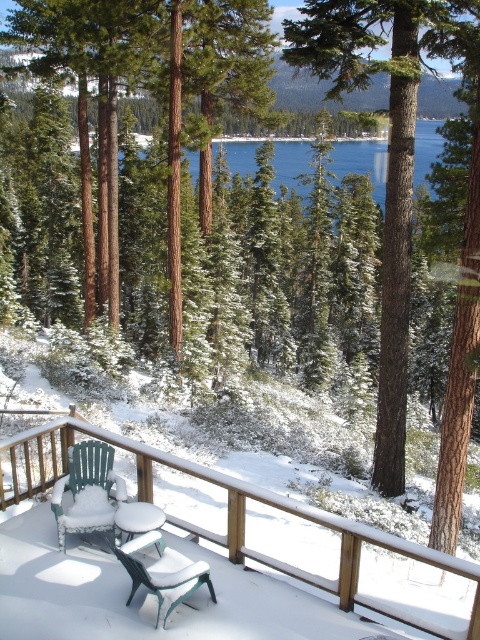
Question: Is blue water at center bigger than green plastic chair at lower center?

Choices:
 (A) no
 (B) yes

Answer: (B)

Question: Does green plastic chairs at lower left have a smaller size compared to green plastic chair at lower left?

Choices:
 (A) no
 (B) yes

Answer: (B)

Question: Which point is closer to the camera taking this photo?

Choices:
 (A) (123, 448)
 (B) (141, 536)

Answer: (B)

Question: Can you confirm if blue water at center is thinner than green plastic chair at lower left?

Choices:
 (A) yes
 (B) no

Answer: (B)

Question: Estimate the real-world distances between objects in this image. Which object is farther from the green plastic chairs at lower left?

Choices:
 (A) green plastic chair at lower left
 (B) brown textured tree at center
 (C) blue water at center

Answer: (C)

Question: Considering the real-world distances, which object is closest to the blue water at center?

Choices:
 (A) green plastic chairs at lower left
 (B) brown textured tree at center
 (C) green plastic chair at lower center

Answer: (C)